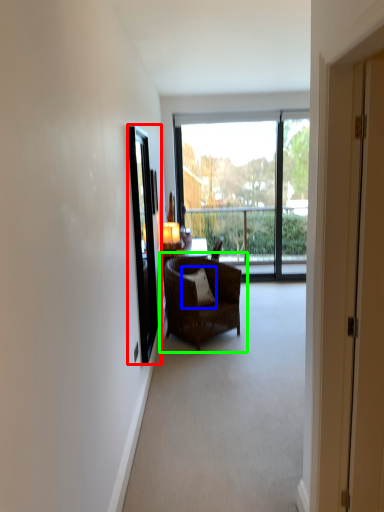
Question: Which object is the farthest from screen door (highlighted by a red box)? Choose among these: pillow (highlighted by a blue box) or chair (highlighted by a green box).

Choices:
 (A) pillow
 (B) chair

Answer: (A)